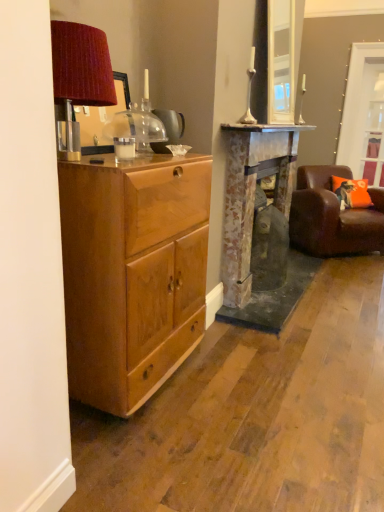
Question: From the image's perspective, is orange fabric pillow at right under brown leather chair at right?

Choices:
 (A) yes
 (B) no

Answer: (B)

Question: Does orange fabric pillow at right have a greater height compared to brown leather chair at right?

Choices:
 (A) no
 (B) yes

Answer: (A)

Question: Is orange fabric pillow at right facing towards brown leather chair at right?

Choices:
 (A) no
 (B) yes

Answer: (B)

Question: Is orange fabric pillow at right to the left of brown leather chair at right from the viewer's perspective?

Choices:
 (A) yes
 (B) no

Answer: (B)

Question: From a real-world perspective, is orange fabric pillow at right physically below brown leather chair at right?

Choices:
 (A) yes
 (B) no

Answer: (B)

Question: Considering the relative positions of orange fabric pillow at right and brown leather chair at right in the image provided, is orange fabric pillow at right to the right of brown leather chair at right from the viewer's perspective?

Choices:
 (A) yes
 (B) no

Answer: (A)

Question: From the image's perspective, would you say clear glass door at upper right is shown under orange fabric pillow at right?

Choices:
 (A) yes
 (B) no

Answer: (B)

Question: Is clear glass door at upper right smaller than orange fabric pillow at right?

Choices:
 (A) yes
 (B) no

Answer: (A)

Question: Is clear glass door at upper right to the right of orange fabric pillow at right from the viewer's perspective?

Choices:
 (A) yes
 (B) no

Answer: (A)

Question: Does clear glass door at upper right appear on the left side of orange fabric pillow at right?

Choices:
 (A) yes
 (B) no

Answer: (B)

Question: Is clear glass door at upper right positioned with its back to orange fabric pillow at right?

Choices:
 (A) yes
 (B) no

Answer: (B)

Question: Is the position of clear glass door at upper right more distant than that of orange fabric pillow at right?

Choices:
 (A) yes
 (B) no

Answer: (A)

Question: Does rustic stone fireplace at center have a smaller size compared to clear glass door at upper right?

Choices:
 (A) no
 (B) yes

Answer: (A)